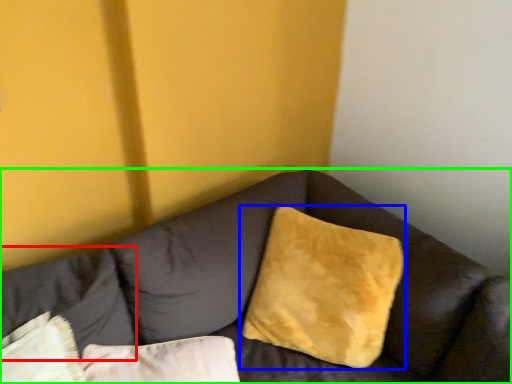
Question: Which is farther away from pillow (highlighted by a red box)? pillow (highlighted by a blue box) or studio couch (highlighted by a green box)?

Choices:
 (A) pillow
 (B) studio couch

Answer: (A)